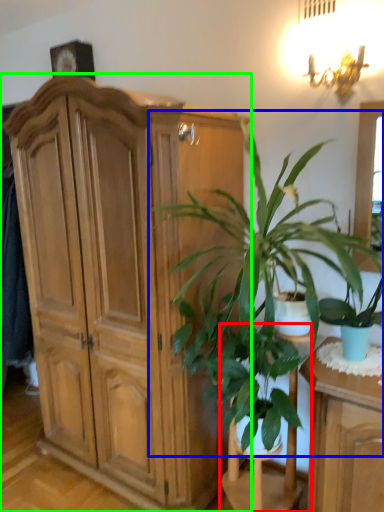
Question: Estimate the real-world distances between objects in this image. Which object is closer to armchair (highlighted by a red box), houseplant (highlighted by a blue box) or cabinetry (highlighted by a green box)?

Choices:
 (A) houseplant
 (B) cabinetry

Answer: (A)